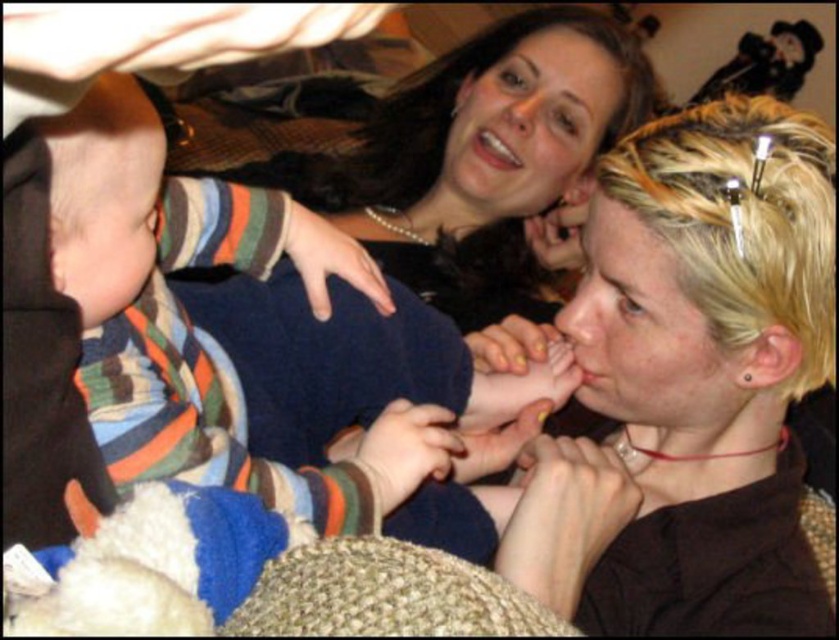
Is smooth blonde hair at center positioned before yellow painted nails at center?

That is True.

Is the position of smooth blonde hair at center more distant than that of yellow painted nails at center?

No, it is in front of yellow painted nails at center.

You are a GUI agent. You are given a task and a screenshot of the screen. Output one action in this format:
    pyautogui.click(x=<x>, y=<y>)
    Task: Click on the smooth blonde hair at center
    This screenshot has height=640, width=839.
    Given the screenshot: What is the action you would take?
    pyautogui.click(x=706, y=365)

Identify the location of smooth blonde hair at center. The height and width of the screenshot is (640, 839). (706, 365).

Between striped cotton shirt at left and matte silver ring at lower center, which one is positioned lower?

matte silver ring at lower center

Can you confirm if striped cotton shirt at left is positioned to the left of matte silver ring at lower center?

Yes, striped cotton shirt at left is to the left of matte silver ring at lower center.

Does point (181, 461) lie in front of point (631, 483)?

Yes.

Image resolution: width=839 pixels, height=640 pixels. What are the coordinates of `striped cotton shirt at left` in the screenshot? It's located at (201, 330).

Is smooth blonde hair at center taller than matte silver ring at lower center?

Yes.

Between smooth blonde hair at center and matte silver ring at lower center, which one is positioned lower?

matte silver ring at lower center is below.

Locate an element on the screen. smooth blonde hair at center is located at coordinates (706, 365).